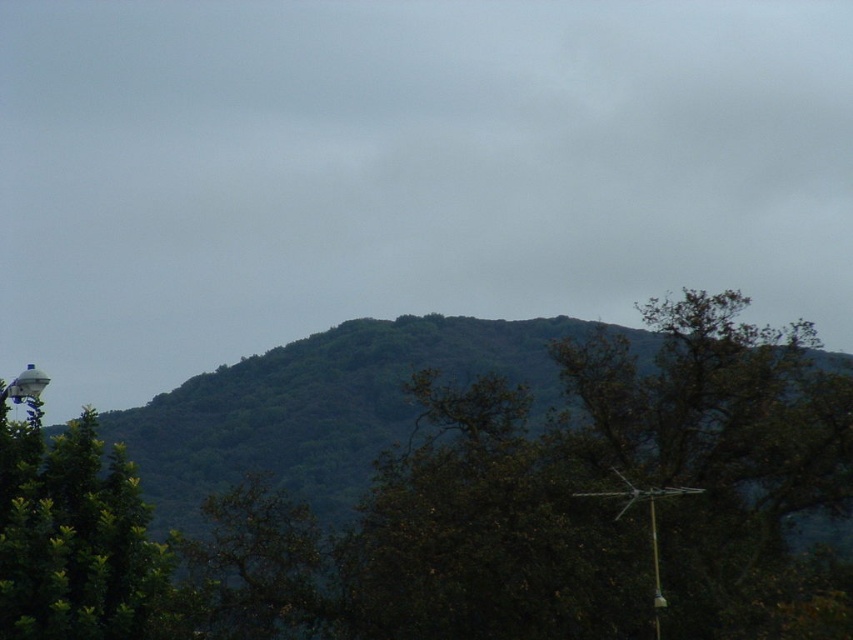
Does green leafy tree at left have a lesser height compared to white plastic lamp post at lower left?

Incorrect, green leafy tree at left's height does not fall short of white plastic lamp post at lower left's.

Which of these two, green leafy tree at left or white plastic lamp post at lower left, stands shorter?

white plastic lamp post at lower left

Which is in front, point (158, 576) or point (7, 387)?

Point (158, 576) is more forward.

At what (x,y) coordinates should I click in order to perform the action: click on green leafy tree at left. Please return your answer as a coordinate pair (x, y). Image resolution: width=853 pixels, height=640 pixels. Looking at the image, I should click on (77, 541).

At what (x,y) coordinates should I click in order to perform the action: click on green leafy tree at center. Please return your answer as a coordinate pair (x, y). The height and width of the screenshot is (640, 853). Looking at the image, I should click on (479, 509).

The image size is (853, 640). What do you see at coordinates (479, 509) in the screenshot?
I see `green leafy tree at center` at bounding box center [479, 509].

In the scene shown: Who is shorter, green leafy tree at center or green leafy tree at left?

green leafy tree at center

Between point (163, 632) and point (138, 620), which one is positioned in front?

Point (163, 632)

Locate an element on the screen. The height and width of the screenshot is (640, 853). green leafy tree at center is located at coordinates (479, 509).